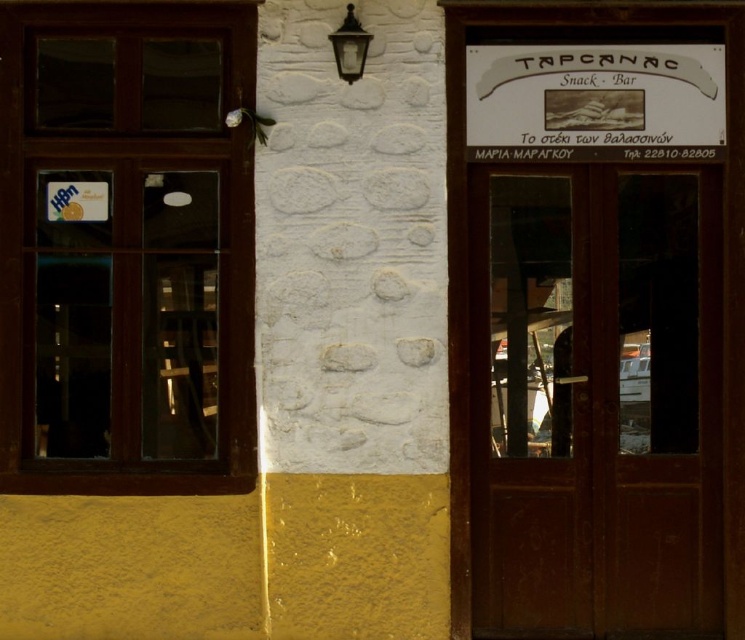
Question: Does brown wooden door at right appear on the right side of white paper sign at upper center?

Choices:
 (A) yes
 (B) no

Answer: (A)

Question: Can you confirm if brown wooden door at right is wider than white paper sign at upper center?

Choices:
 (A) no
 (B) yes

Answer: (A)

Question: Which point is farther to the camera?

Choices:
 (A) brown wooden door at right
 (B) brown wooden window at left
 (C) white paper sign at upper center

Answer: (A)

Question: Which object is closer to the camera taking this photo?

Choices:
 (A) brown wooden window at left
 (B) white paper sign at upper center
 (C) brown wooden door at right

Answer: (A)

Question: Is brown wooden door at right to the left of white paper sign at upper center from the viewer's perspective?

Choices:
 (A) yes
 (B) no

Answer: (B)

Question: Among these objects, which one is farthest from the camera?

Choices:
 (A) white paper sign at upper center
 (B) brown wooden door at right
 (C) brown wooden window at left

Answer: (B)